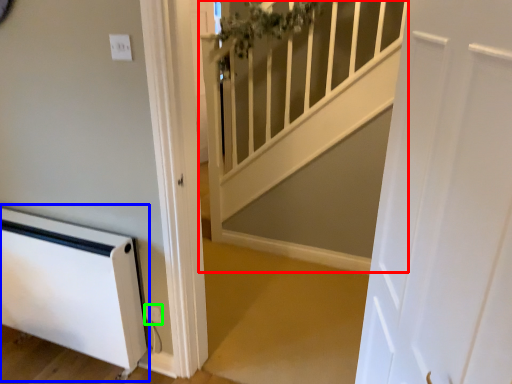
Question: Considering the real-world distances, which object is closest to stairwell (highlighted by a red box)? appliance (highlighted by a blue box) or electric outlet (highlighted by a green box).

Choices:
 (A) appliance
 (B) electric outlet

Answer: (A)